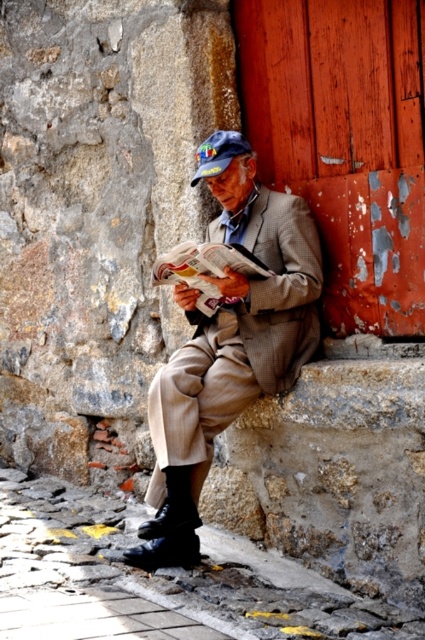
You are standing in front of the peeling paint door at right and the checkered wool suit at center. Which object is positioned to the right of the other?

The peeling paint door at right is to the right of the checkered wool suit at center.

You are a delivery person trying to reach the door to deliver a package. You see the peeling paint door at right and the checkered wool suit at center. Which object is closer to you?

The peeling paint door at right is closer to you because it is in front of the checkered wool suit at center.